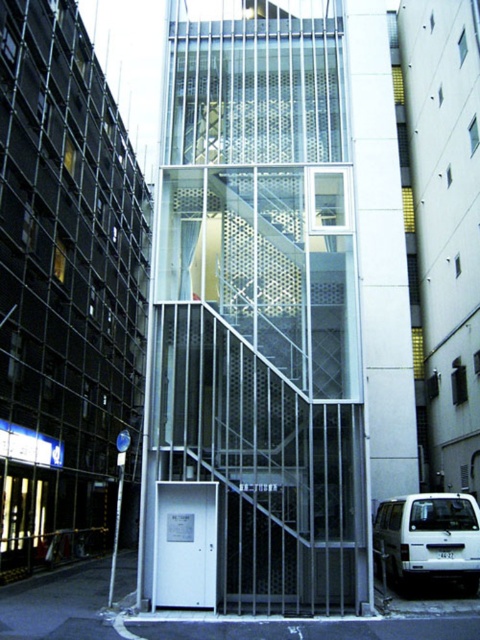
You are standing at the entrance of the building and want to take the transparent glass elevator at center to the upper floor. However, there is a white matte suv at lower right blocking the path. Can you still reach the elevator?

The transparent glass elevator at center is to the left of the white matte suv at lower right, so you can go around the suv to reach the elevator.

You are a delivery person trying to load a package into the transparent glass elevator at center. The white matte suv at lower right is your vehicle. Can you fit the package into the elevator if it is as tall as your vehicle?

The transparent glass elevator at center is much taller than the white matte suv at lower right, so the package can fit inside the elevator if it matches the height of the vehicle.

You are standing at the base of the tall, narrow building and want to take the transparent glass elevator at center to the top floor. However, there is a white matte suv at lower right blocking your path. Can you walk around the suv to reach the elevator?

The transparent glass elevator at center is above the white matte suv at lower right, so the suv is located below the elevator. Since the suv is at the base, you can walk around it to reach the elevator.